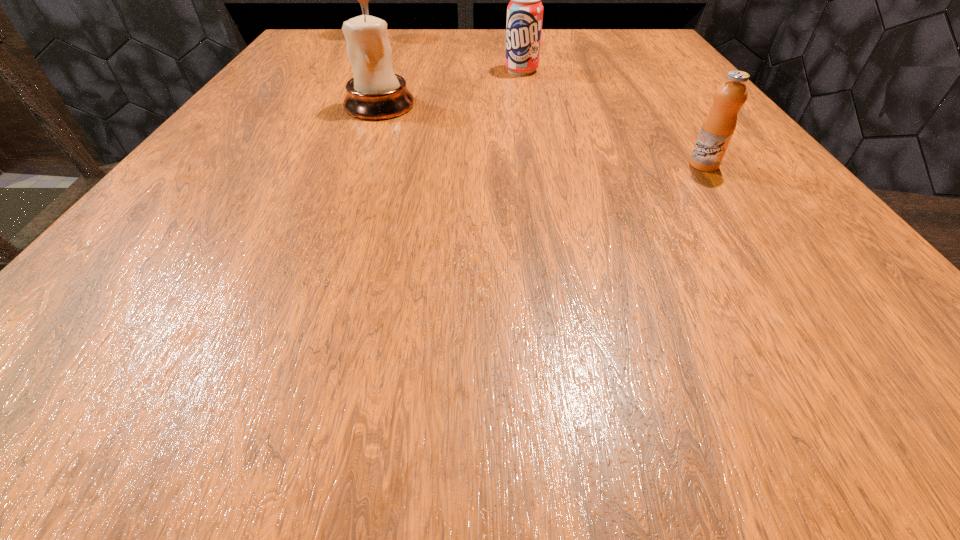
Select which object is the second closest to the candle holder. Please provide its 2D coordinates. Your answer should be formatted as a tuple, i.e. [(x, y)], where the tuple contains the x and y coordinates of a point satisfying the conditions above.

[(363, 0)]